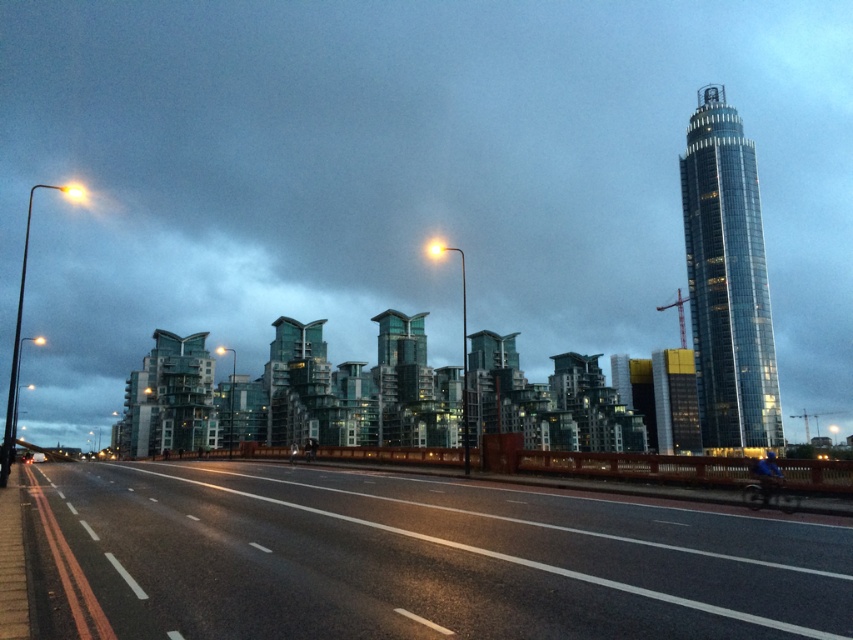
You are a delivery drone flying over the city and need to land on the black asphalt highway at lower left. According to the coordinates provided, where should you aim to land?

The black asphalt highway at lower left is located at coordinates point (432, 560), so you should aim for that specific point to land.

You are a city planner analyzing the urban layout. Given the black asphalt highway at lower left and the shiny glass tower at upper right, which one has a greater width?

The black asphalt highway at lower left has a greater width than the shiny glass tower at upper right, as stated in the description.

You are a pedestrian standing at the intersection and want to cross the black asphalt highway at lower left to reach the shiny glass tower at upper right. Is the highway blocking your direct path to the tower?

The black asphalt highway at lower left is in front of the shiny glass tower at upper right, so the highway is blocking your direct path to the tower.